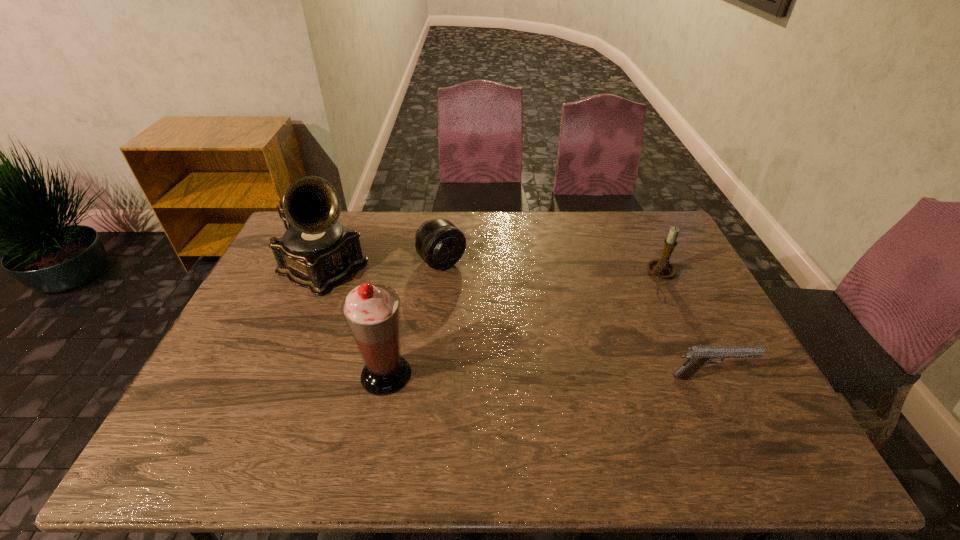
Identify the location of free space on the desktop that is between the smoothie and the shortest object and is positioned on the side of the candle holder with the handle. Image resolution: width=960 pixels, height=540 pixels. (506, 375).

Find the location of a particular element. free space on the desktop that is between the second tallest object and the pistol and is positioned on the front-facing side of the second shortest object is located at coordinates (552, 376).

The width and height of the screenshot is (960, 540). Find the location of `vacant space on the desktop that is between the smoothie and the shortest object and is positioned on the horn of the phonograph record`. vacant space on the desktop that is between the smoothie and the shortest object and is positioned on the horn of the phonograph record is located at coordinates (531, 376).